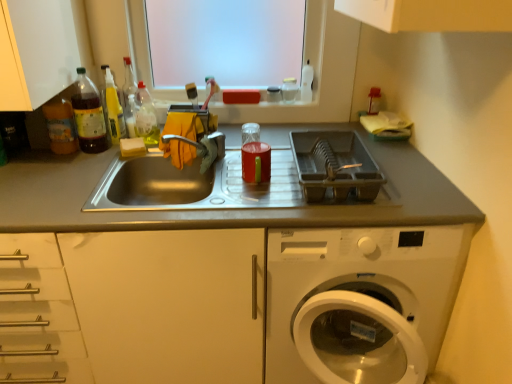
This screenshot has height=384, width=512. I want to click on vacant area situated to the left side of translucent plastic bottle at left, which is the third bottle from right to left, so pyautogui.click(x=32, y=157).